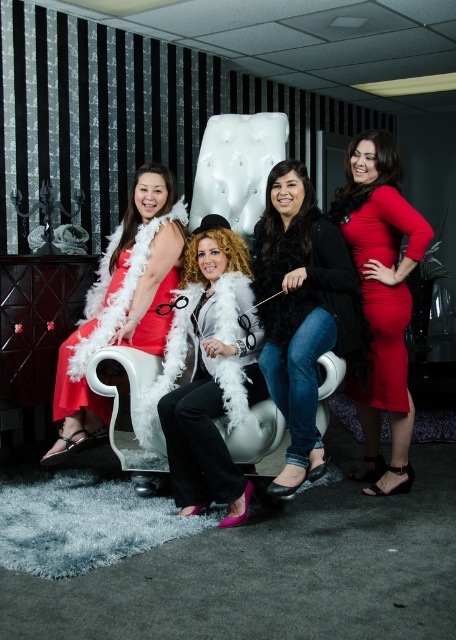
Does black fur coat at center have a lesser width compared to white fluffy coat at center?

In fact, black fur coat at center might be wider than white fluffy coat at center.

Between black fur coat at center and white fluffy coat at center, which one has more height?

Standing taller between the two is black fur coat at center.

What do you see at coordinates (301, 308) in the screenshot?
I see `black fur coat at center` at bounding box center [301, 308].

Identify the location of black fur coat at center. The image size is (456, 640). (301, 308).

Image resolution: width=456 pixels, height=640 pixels. Identify the location of black fur coat at center. (301, 308).

From the picture: Can you confirm if black fur coat at center is thinner than matte white feather boa at center?

Indeed, black fur coat at center has a lesser width compared to matte white feather boa at center.

What do you see at coordinates (301, 308) in the screenshot?
I see `black fur coat at center` at bounding box center [301, 308].

Identify the location of black fur coat at center. (301, 308).

Is point (352, 384) farther from viewer compared to point (66, 349)?

Yes.

Where is `matte red dress at right`? The height and width of the screenshot is (640, 456). matte red dress at right is located at coordinates (382, 298).

I want to click on matte red dress at right, so click(x=382, y=298).